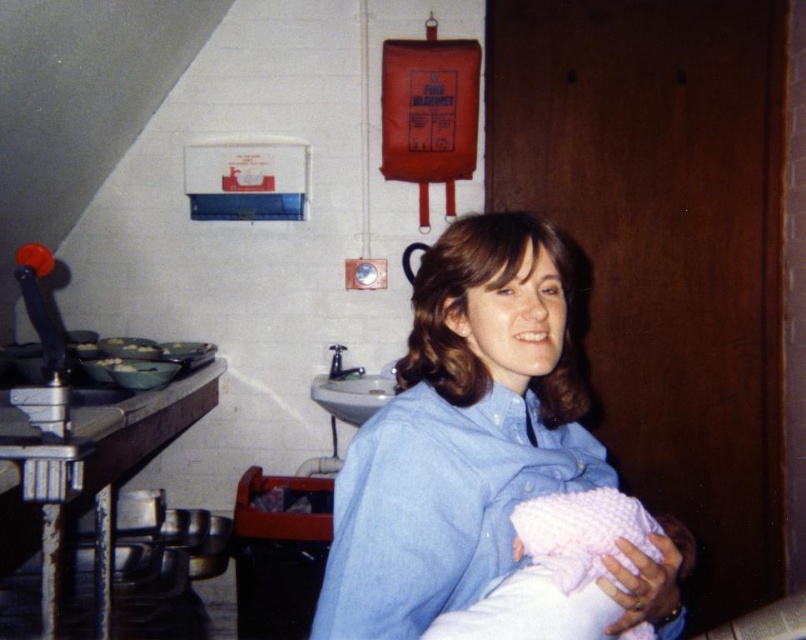
You are standing in the kitchen and want to reach a point that is 3.63 feet away from you. Can you confirm if the point at coordinates point(509, 285) is exactly at that distance?

Yes, the point at coordinates point(509, 285) is exactly 3.63 feet away from the viewer.

You are a photographer setting up for a family photo shoot in the described room. You need to position a light source so it illuminates both the blue cotton shirt at center and the pink knitted blanket at lower center without casting harsh shadows. Considering their positions, where should you place the light source relative to the two objects?

Since the blue cotton shirt at center is located above the pink knitted blanket at lower center, placing the light source directly above both objects would ensure even illumination and minimize harsh shadows between them.